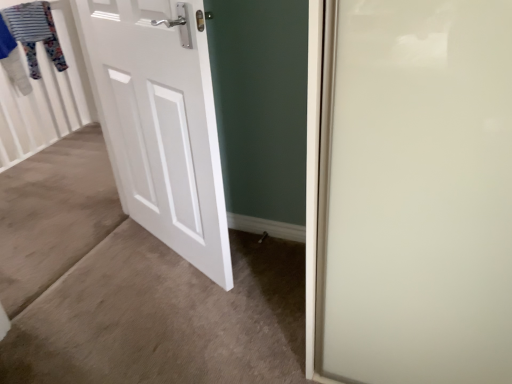
Question: Do you think white matte door at left is within striped fabric clothesline at upper left, or outside of it?

Choices:
 (A) outside
 (B) inside

Answer: (A)

Question: Is white matte door at left bigger or smaller than striped fabric clothesline at upper left?

Choices:
 (A) big
 (B) small

Answer: (A)

Question: From the image's perspective, is white matte door at left located above or below striped fabric clothesline at upper left?

Choices:
 (A) below
 (B) above

Answer: (A)

Question: Considering the positions of striped fabric clothesline at upper left and white matte door at left in the image, is striped fabric clothesline at upper left wider or thinner than white matte door at left?

Choices:
 (A) wide
 (B) thin

Answer: (A)

Question: From the image's perspective, is striped fabric clothesline at upper left above or below white matte door at left?

Choices:
 (A) above
 (B) below

Answer: (A)

Question: Is striped fabric clothesline at upper left taller or shorter than white matte door at left?

Choices:
 (A) short
 (B) tall

Answer: (A)

Question: Considering the positions of striped fabric clothesline at upper left and white matte door at left in the image, is striped fabric clothesline at upper left bigger or smaller than white matte door at left?

Choices:
 (A) big
 (B) small

Answer: (B)